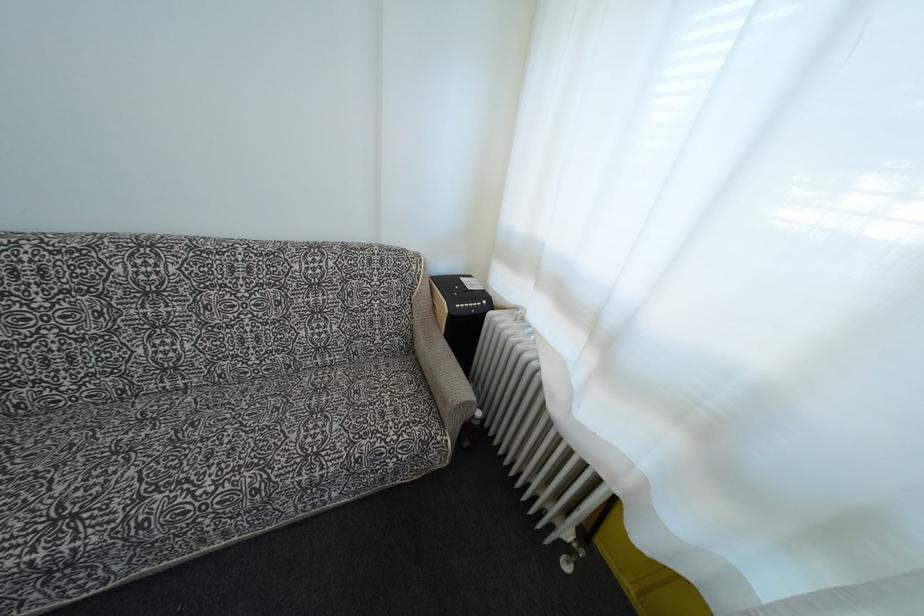
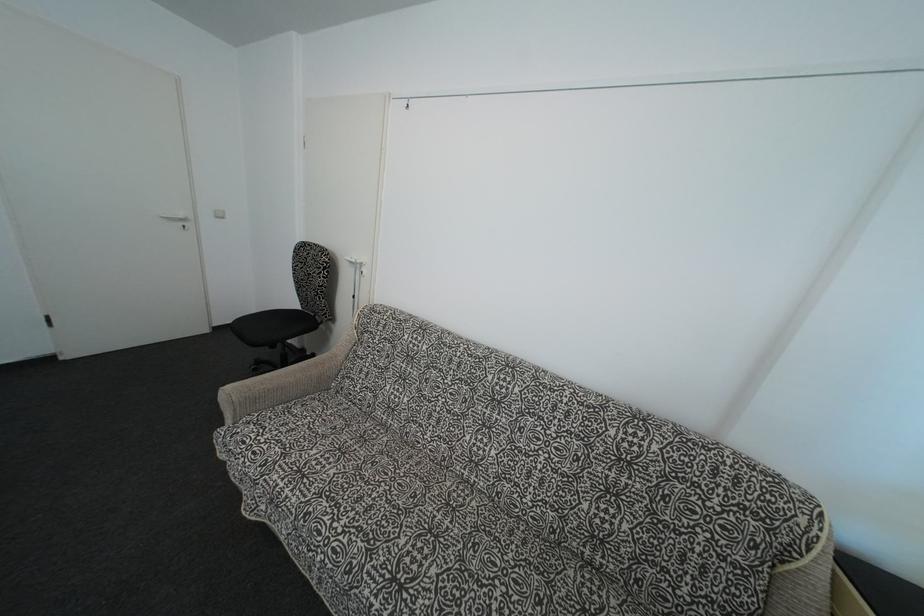
Question: The camera is either moving clockwise (left) or counter-clockwise (right) around the object. The first image is from the beginning of the video and the second image is from the end. Is the camera moving left or right when shooting the video?

Choices:
 (A) Left
 (B) Right

Answer: (B)